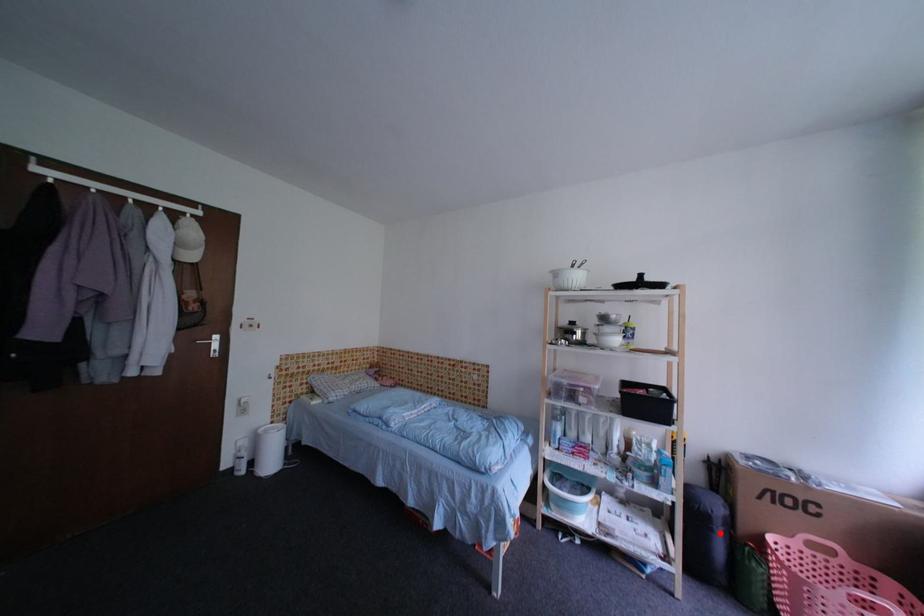
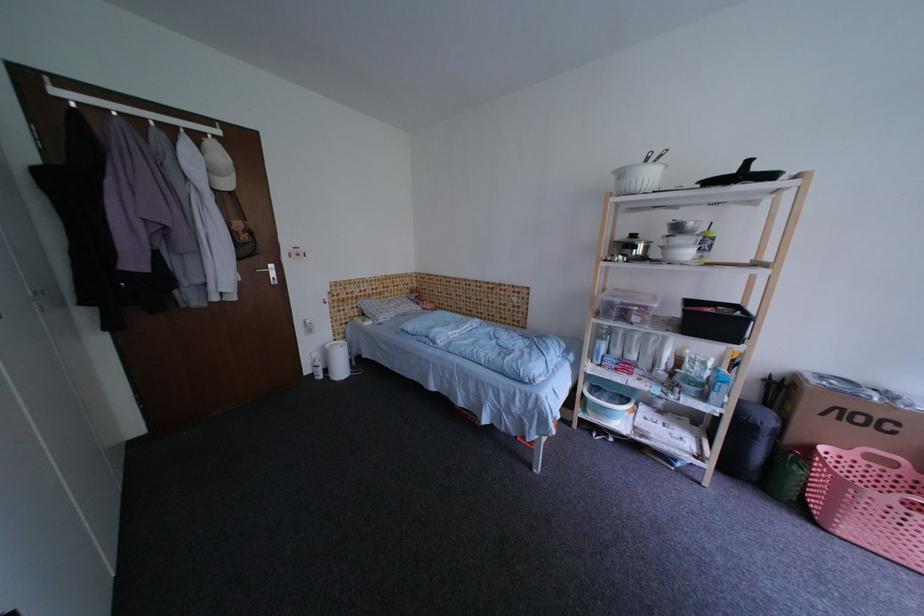
Question: I am providing you with two images of the same scene from different viewpoints. A red point is shown in image1. For the corresponding object point in image2, is it positioned nearer or farther from the camera?

Choices:
 (A) Nearer
 (B) Farther

Answer: (B)